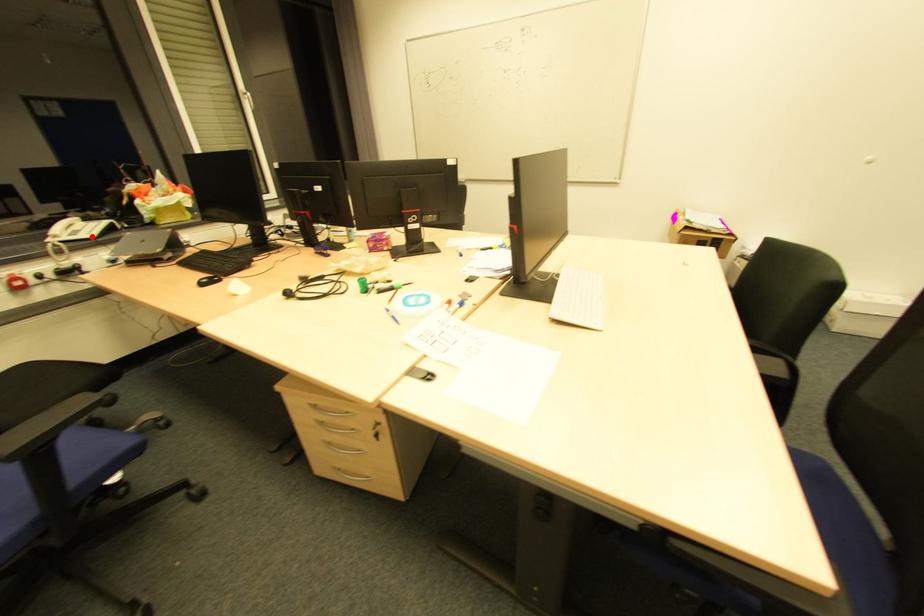
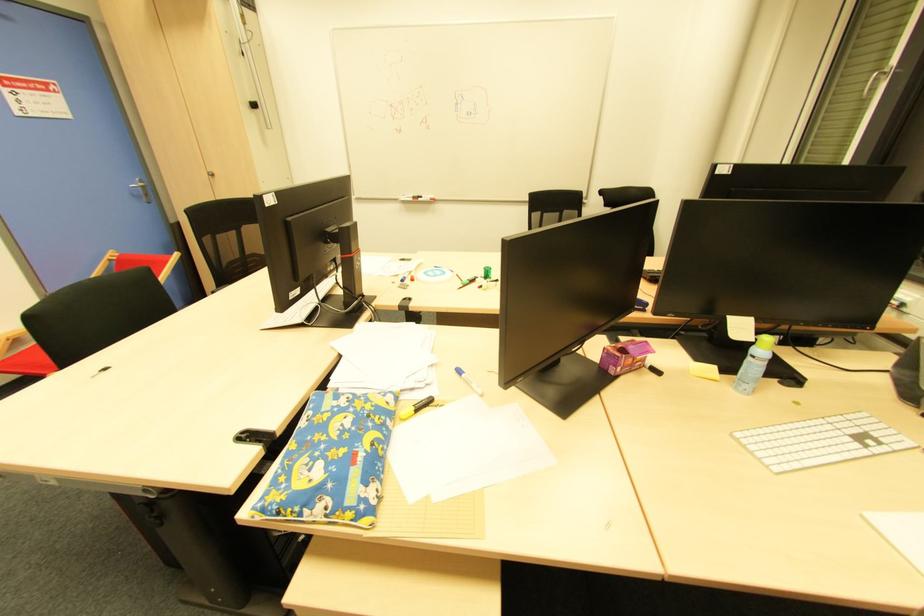
Question: I am providing you with two images of the same scene from different viewpoints. A red point is marked on the first image. Is the red point's position out of view in image 2?

Choices:
 (A) Yes
 (B) No

Answer: (A)